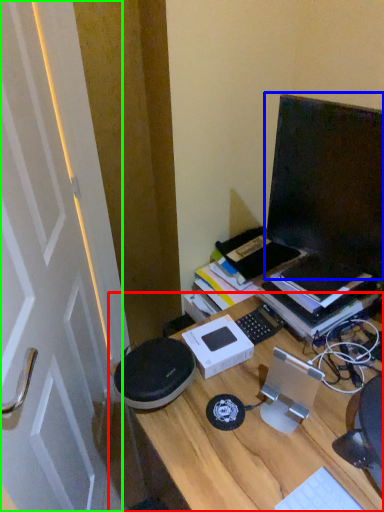
Question: Considering the real-world distances, which object is farthest from desk (highlighted by a red box)? computer monitor (highlighted by a blue box) or door (highlighted by a green box)?

Choices:
 (A) computer monitor
 (B) door

Answer: (B)